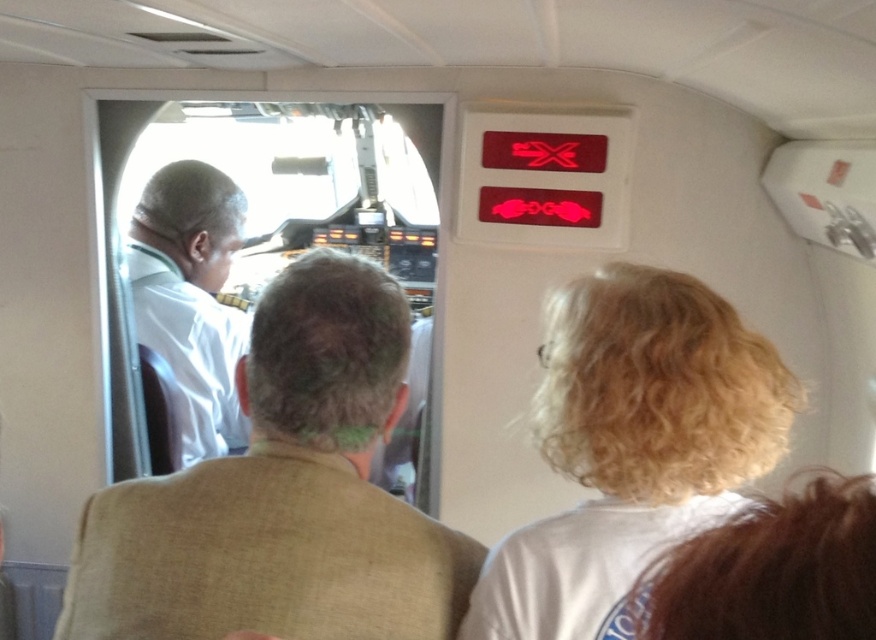
Does blonde curly hair at upper right have a smaller size compared to white shirt at left?

Yes.

Does blonde curly hair at upper right come behind white shirt at left?

That is False.

Who is more distant from viewer, (711, 563) or (216, 234)?

The point (216, 234) is more distant.

Find the location of a particular element. blonde curly hair at upper right is located at coordinates (769, 570).

Between white linen shirt at center and white curly hair at upper right, which one appears on the left side from the viewer's perspective?

white linen shirt at center

Between point (246, 512) and point (605, 572), which one is positioned in front?

Positioned in front is point (246, 512).

What are the coordinates of `white linen shirt at center` in the screenshot? It's located at (283, 493).

Does white curly hair at upper right have a lesser height compared to blonde curly hair at upper right?

No, white curly hair at upper right is not shorter than blonde curly hair at upper right.

Is white curly hair at upper right smaller than blonde curly hair at upper right?

Incorrect, white curly hair at upper right is not smaller in size than blonde curly hair at upper right.

Find the location of a particular element. This screenshot has height=640, width=876. white curly hair at upper right is located at coordinates (632, 445).